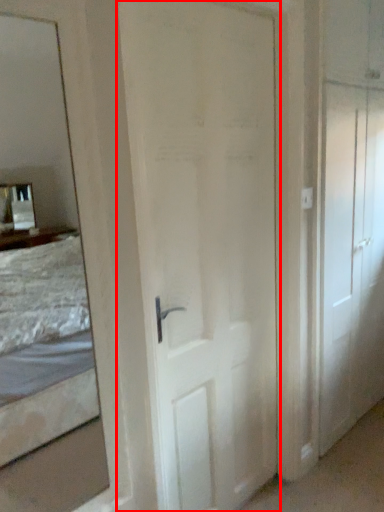
Question: Considering the relative positions of door (annotated by the red box) and door in the image provided, where is door (annotated by the red box) located with respect to the staircase?

Choices:
 (A) left
 (B) right

Answer: (A)